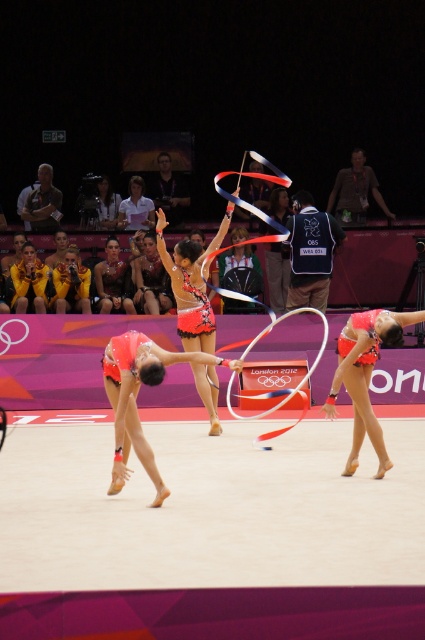
Who is more distant from viewer, (96, 285) or (74, 291)?

The point (96, 285) is behind.

Who is more forward, (130,280) or (84,280)?

Positioned in front is point (84,280).

Locate an element on the screen. The width and height of the screenshot is (425, 640). shiny silver gymnastics outfit at center is located at coordinates (113, 280).

Can you confirm if shiny red leotard at center is taller than shiny red fabric at center?

No.

Where is `shiny red leotard at center`? shiny red leotard at center is located at coordinates (365, 374).

Is point (391, 340) behind point (214, 321)?

No.

Identify the location of shiny red leotard at center. This screenshot has height=640, width=425. tap(365, 374).

Is shiny red fabric at center in front of shiny silver gymnastics outfit at center?

That is True.

Who is positioned more to the left, shiny red fabric at center or shiny silver gymnastics outfit at center?

shiny silver gymnastics outfit at center is more to the left.

Between point (206, 298) and point (110, 288), which one is positioned in front?

Point (206, 298) is more forward.

You are a GUI agent. You are given a task and a screenshot of the screen. Output one action in this format:
    pyautogui.click(x=<x>, y=<y>)
    Task: Click on the shiny red fabric at center
    The height and width of the screenshot is (640, 425).
    Given the screenshot: What is the action you would take?
    pyautogui.click(x=192, y=284)